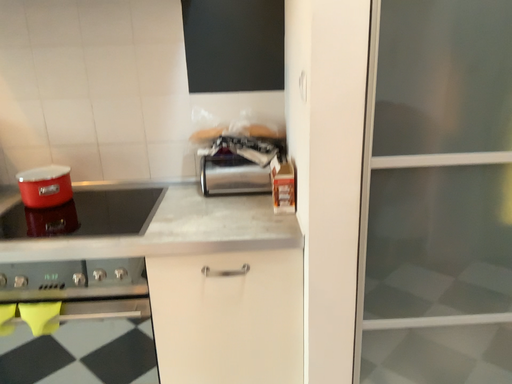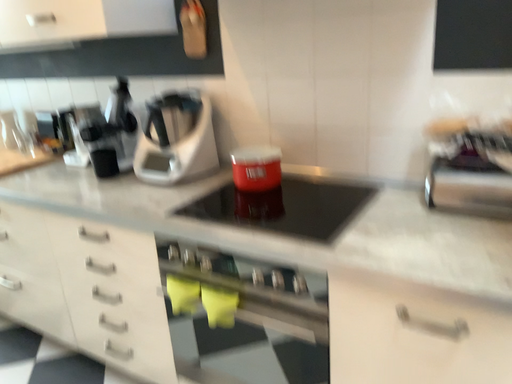
Question: How did the camera likely rotate when shooting the video?

Choices:
 (A) rotated left
 (B) rotated right

Answer: (A)